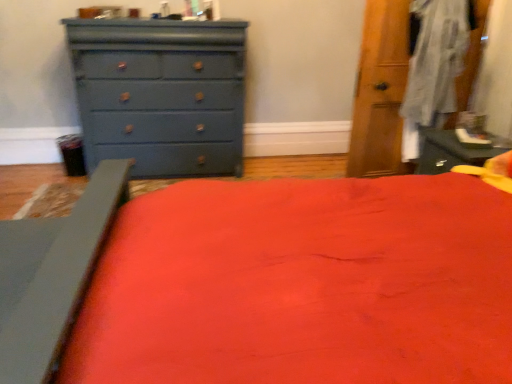
Question: Can you confirm if matte gray bed frame at lower left is shorter than matte blue dresser at left?

Choices:
 (A) yes
 (B) no

Answer: (A)

Question: Is matte gray bed frame at lower left taller than matte blue dresser at left?

Choices:
 (A) yes
 (B) no

Answer: (B)

Question: Is matte gray bed frame at lower left oriented towards matte blue dresser at left?

Choices:
 (A) yes
 (B) no

Answer: (B)

Question: Can you confirm if matte gray bed frame at lower left is thinner than matte blue dresser at left?

Choices:
 (A) no
 (B) yes

Answer: (B)

Question: From the image's perspective, does matte gray bed frame at lower left appear higher than matte blue dresser at left?

Choices:
 (A) no
 (B) yes

Answer: (A)

Question: Is matte gray bed frame at lower left far from matte blue dresser at left?

Choices:
 (A) no
 (B) yes

Answer: (B)

Question: From a real-world perspective, is matte blue dresser at left positioned under matte gray bed frame at lower left based on gravity?

Choices:
 (A) no
 (B) yes

Answer: (A)

Question: Considering the relative positions of matte blue dresser at left and matte gray bed frame at lower left in the image provided, is matte blue dresser at left behind matte gray bed frame at lower left?

Choices:
 (A) no
 (B) yes

Answer: (B)

Question: Considering the relative sizes of matte blue dresser at left and matte gray bed frame at lower left in the image provided, is matte blue dresser at left shorter than matte gray bed frame at lower left?

Choices:
 (A) no
 (B) yes

Answer: (A)

Question: Is matte blue dresser at left touching matte gray bed frame at lower left?

Choices:
 (A) no
 (B) yes

Answer: (A)

Question: Can we say matte blue dresser at left lies outside matte gray bed frame at lower left?

Choices:
 (A) no
 (B) yes

Answer: (B)

Question: From a real-world perspective, is matte blue dresser at left on top of matte gray bed frame at lower left?

Choices:
 (A) yes
 (B) no

Answer: (A)

Question: Choose the correct answer: Is matte blue dresser at left inside matte gray bed frame at lower left or outside it?

Choices:
 (A) inside
 (B) outside

Answer: (B)